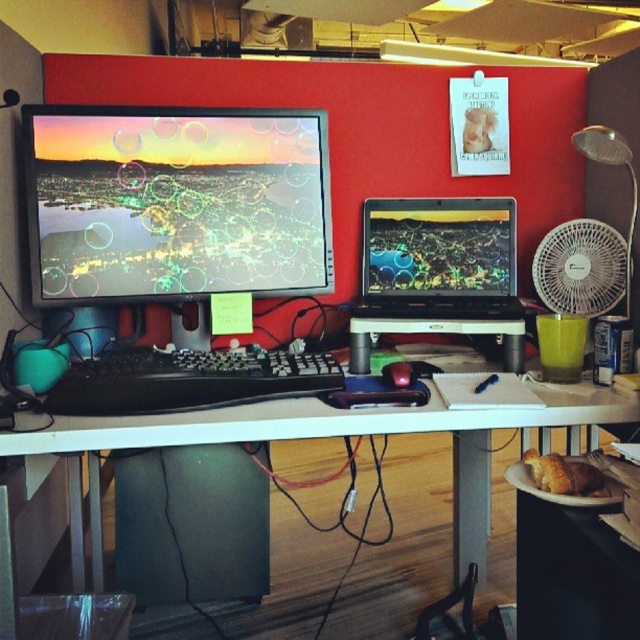
Please provide the 2D coordinates of the white plastic computer desk at center as given in the description.

The white plastic computer desk at center is located at coordinates point (340, 436).

Based on the photo, you are standing at the point labeled as point [410,291] in the workspace. You need to reach the desk which is 1.8 meters away from you. Can you walk straight to the desk without moving any objects?

The distance between point [410,291] and the desk is 1.8 meters, so yes, you can walk straight to the desk without moving any objects as there is enough space.